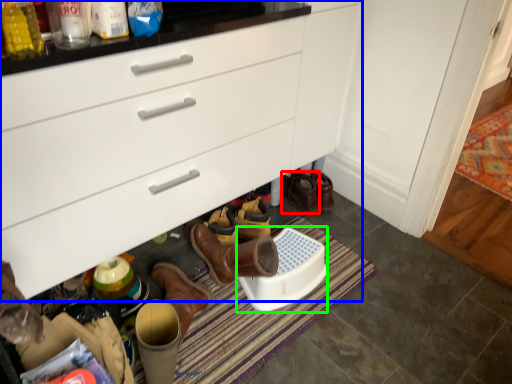
Question: Based on their relative distances, which object is nearer to footwear (highlighted by a red box)? Choose from cabinetry (highlighted by a blue box) and corded phone (highlighted by a green box).

Choices:
 (A) cabinetry
 (B) corded phone

Answer: (B)